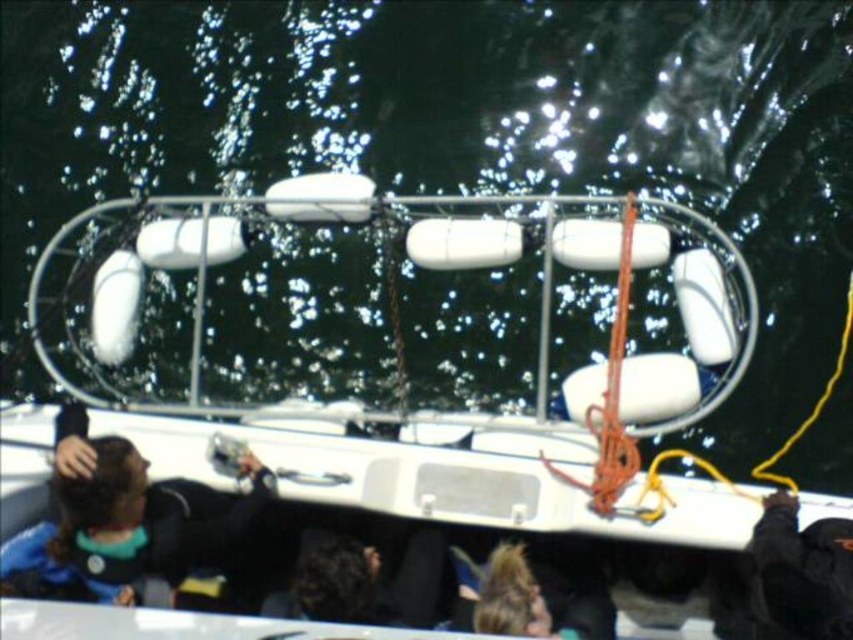
Question: Is white matte lifebuoys at center smaller than blue fabric jacket at lower left?

Choices:
 (A) yes
 (B) no

Answer: (B)

Question: In this image, where is white matte lifebuoys at center located relative to blue fabric jacket at lower left?

Choices:
 (A) above
 (B) below

Answer: (A)

Question: Which point is closer to the camera?

Choices:
 (A) blue fabric jacket at lower left
 (B) white matte lifebuoys at center

Answer: (B)

Question: Which object appears farthest from the camera in this image?

Choices:
 (A) white matte lifebuoys at center
 (B) blue fabric jacket at lower left

Answer: (B)

Question: Is white matte lifebuoys at center positioned before blue fabric jacket at lower left?

Choices:
 (A) yes
 (B) no

Answer: (A)